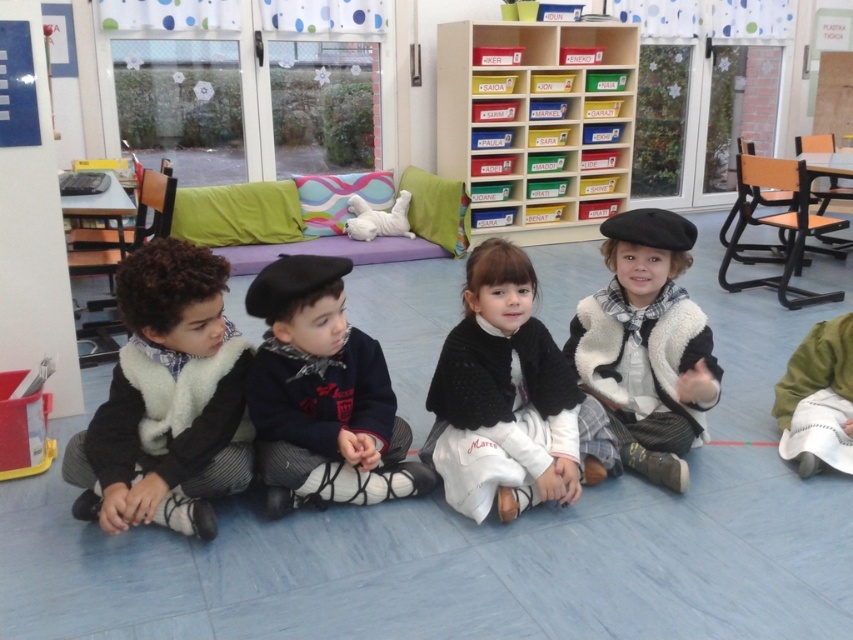
You are a photographer standing at the camera position. You want to take a photo of the children but need to ensure the point at coordinates point [314,317] is in focus. What is the minimum focusing distance required to capture this point clearly?

The minimum focusing distance required to capture the point at coordinates point [314,317] clearly is 2.04 meters, as that is the distance from the camera to the point.

You are a costume designer looking at the image of the children in the classroom. You need to adjust the positioning of the matte black beret at center and the white fuzzy coat at center so that the beret is now to the right of the coat. Is this possible without moving any other items?

The matte black beret at center is currently to the left of the white fuzzy coat at center. To move the beret to the right of the coat, you would need to shift the beret past the coat, but since they are both at center, this might require rearranging their positions while keeping other items fixed. However, without additional space or moving other items, it may not be feasible.

You are a costume designer trying to determine if the matte black beret at center can be placed on top of the fuzzy white coat at center without falling off. Based on their widths, will it stay in place?

The matte black beret at center might be wider than fuzzy white coat at center, so it might not stay in place as the beret could extend beyond the coat.